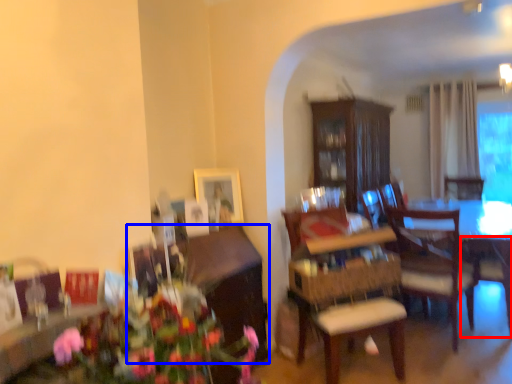
Question: Among these objects, which one is farthest to the camera, armchair (highlighted by a red box) or cabinetry (highlighted by a blue box)?

Choices:
 (A) armchair
 (B) cabinetry

Answer: (A)